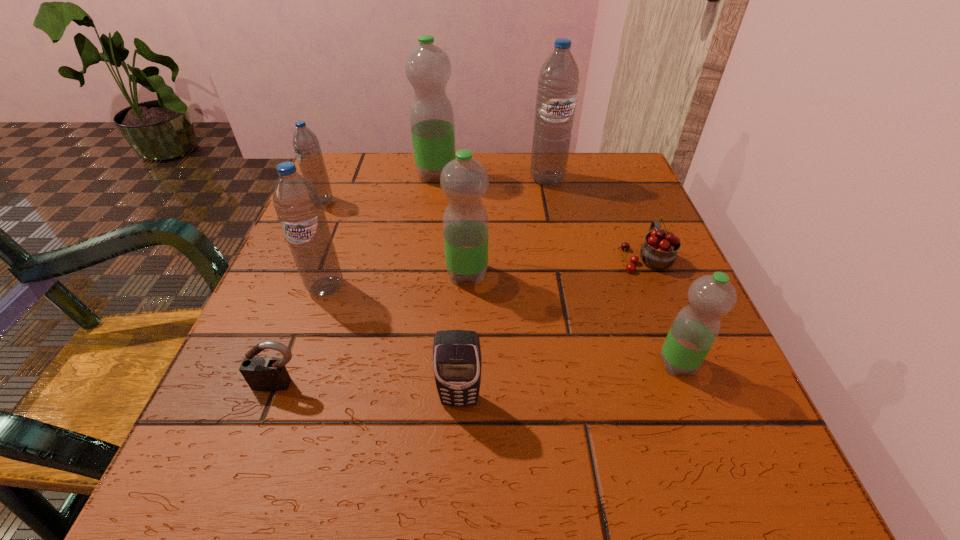
The width and height of the screenshot is (960, 540). What are the coordinates of `the third shortest object` in the screenshot? It's located at (457, 361).

The height and width of the screenshot is (540, 960). Find the location of `padlock`. padlock is located at coordinates (261, 373).

I want to click on red cherry, so click(x=659, y=251).

Where is `free space located on the left of the biggest green water bottle`? free space located on the left of the biggest green water bottle is located at coordinates (340, 175).

Find the location of `vacant region located 0.080m on the right of the second water bottle from right to left`. vacant region located 0.080m on the right of the second water bottle from right to left is located at coordinates pyautogui.click(x=599, y=179).

Identify the location of free space located 0.170m on the back of the second smallest green water bottle. The height and width of the screenshot is (540, 960). (469, 207).

Locate an element on the screen. The height and width of the screenshot is (540, 960). free space located 0.260m on the back of the second blue water bottle from left to right is located at coordinates (359, 194).

Where is `free space located 0.330m on the front of the smallest blue water bottle`? free space located 0.330m on the front of the smallest blue water bottle is located at coordinates (266, 326).

Image resolution: width=960 pixels, height=540 pixels. I want to click on vacant region located on the left of the rightmost green water bottle, so click(x=544, y=363).

At what (x,y) coordinates should I click in order to perform the action: click on vacant area situated 0.140m with the keyhole on the front of the padlock. Please return your answer as a coordinate pair (x, y). Looking at the image, I should click on (x=238, y=495).